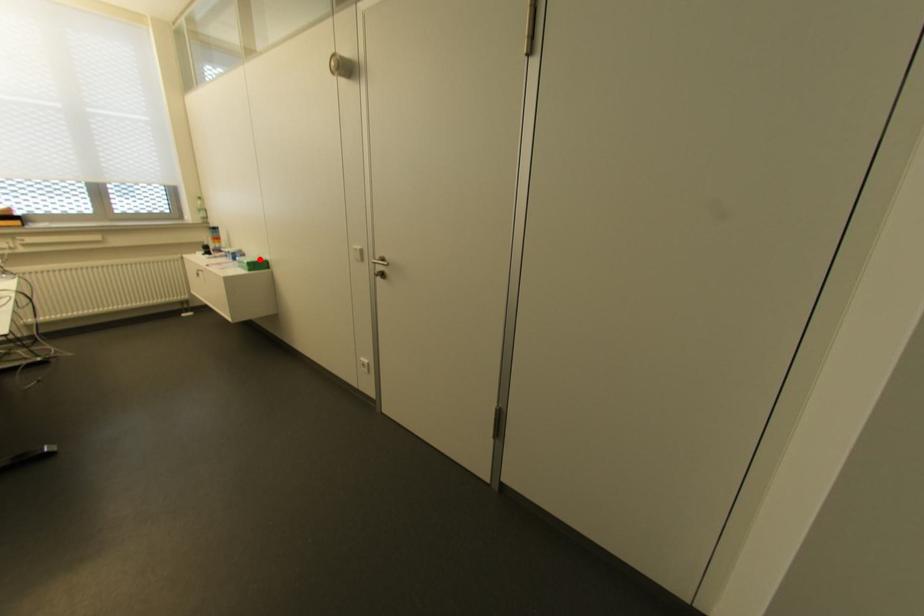
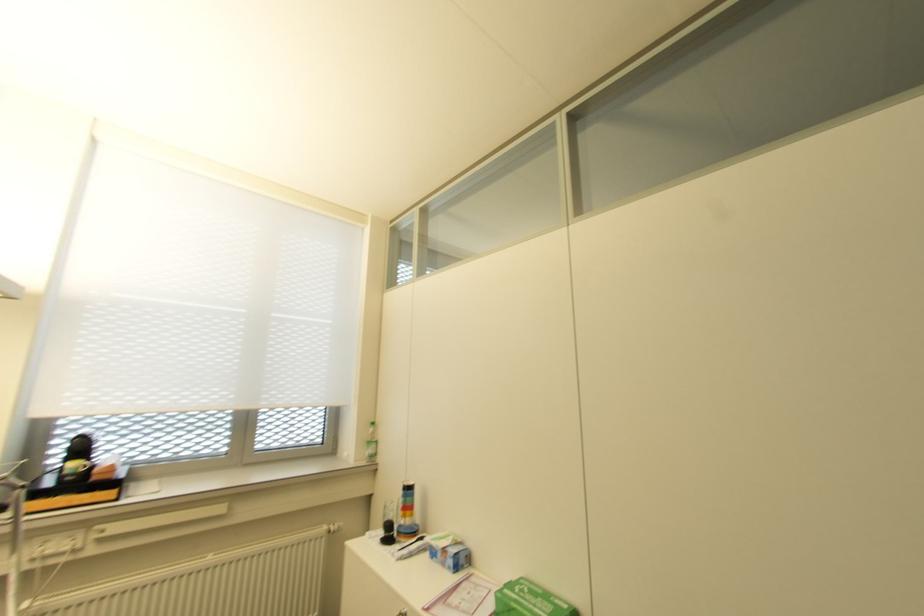
Locate, in the second image, the point that corresponds to the highlighted location in the first image.

(563, 605)